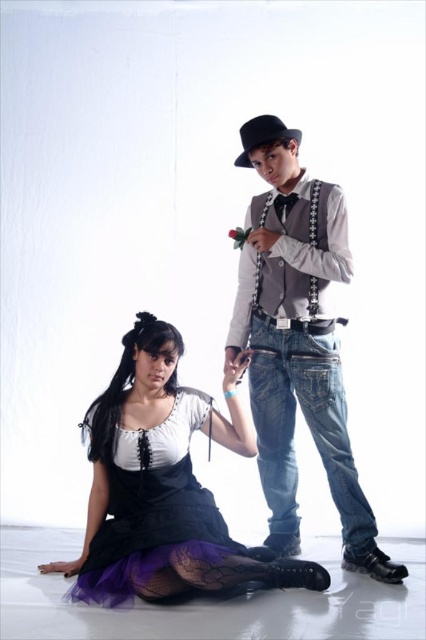
Can you confirm if matte black dress at lower left is bigger than gray matte vest at center?

Correct, matte black dress at lower left is larger in size than gray matte vest at center.

Can you confirm if matte black dress at lower left is positioned below gray matte vest at center?

Yes, matte black dress at lower left is below gray matte vest at center.

Is point (302, 572) behind point (301, 298)?

No, (302, 572) is closer to viewer.

Identify the location of matte black dress at lower left. This screenshot has width=426, height=640. 233,419.

Between gray matte vest at center and black tulle dress at lower left, which one has more height?

With more height is gray matte vest at center.

Is gray matte vest at center further to the viewer compared to black tulle dress at lower left?

Yes, gray matte vest at center is further from the viewer.

Which is in front, point (307, 273) or point (170, 413)?

Point (307, 273) is in front.

Locate an element on the screen. The image size is (426, 640). gray matte vest at center is located at coordinates (299, 349).

Between matte black dress at lower left and black tulle dress at lower left, which one is positioned higher?

matte black dress at lower left is higher up.

Does matte black dress at lower left have a larger size compared to black tulle dress at lower left?

Yes, matte black dress at lower left is bigger than black tulle dress at lower left.

Which is in front, point (181, 428) or point (163, 520)?

Point (163, 520)

You are a GUI agent. You are given a task and a screenshot of the screen. Output one action in this format:
    pyautogui.click(x=<x>, y=<y>)
    Task: Click on the matte black dress at lower left
    
    Given the screenshot: What is the action you would take?
    pyautogui.click(x=233, y=419)